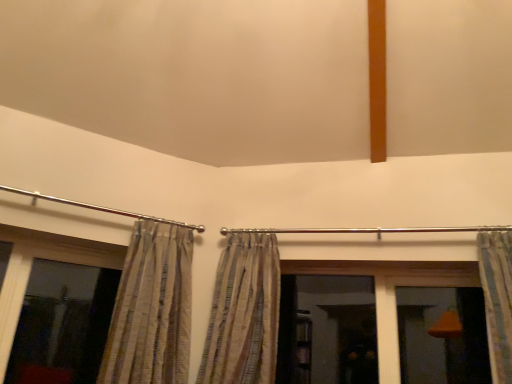
Question: Would you say transparent glass window at left is a long distance from striped fabric curtain at left, which is the first curtain in left-to-right order?

Choices:
 (A) no
 (B) yes

Answer: (A)

Question: Could striped fabric curtain at left, which is the first curtain in left-to-right order, be considered to be inside transparent glass window at left?

Choices:
 (A) no
 (B) yes

Answer: (A)

Question: From a real-world perspective, is transparent glass window at left on striped fabric curtain at left, which is the third curtain from right to left?

Choices:
 (A) no
 (B) yes

Answer: (A)

Question: Is transparent glass window at left to the left of striped fabric curtain at left, which is the third curtain from right to left, from the viewer's perspective?

Choices:
 (A) yes
 (B) no

Answer: (A)

Question: Is transparent glass window at left oriented towards striped fabric curtain at left, which is the third curtain from right to left?

Choices:
 (A) no
 (B) yes

Answer: (B)

Question: Can you confirm if transparent glass window at left is bigger than striped fabric curtain at left, which is the third curtain from right to left?

Choices:
 (A) no
 (B) yes

Answer: (A)

Question: Does striped fabric curtain at right, the third curtain when ordered from left to right, have a greater height compared to striped fabric curtain at center, which is the second curtain from right to left?

Choices:
 (A) yes
 (B) no

Answer: (B)

Question: Considering the relative positions of striped fabric curtain at right, which ranks as the 1th curtain in right-to-left order, and striped fabric curtain at center, marked as the second curtain in a left-to-right arrangement, in the image provided, is striped fabric curtain at right, which ranks as the 1th curtain in right-to-left order, to the left of striped fabric curtain at center, marked as the second curtain in a left-to-right arrangement, from the viewer's perspective?

Choices:
 (A) no
 (B) yes

Answer: (A)

Question: From a real-world perspective, is striped fabric curtain at right, which ranks as the 1th curtain in right-to-left order, positioned under striped fabric curtain at center, marked as the second curtain in a left-to-right arrangement, based on gravity?

Choices:
 (A) yes
 (B) no

Answer: (B)

Question: Is striped fabric curtain at right, the third curtain when ordered from left to right, not near striped fabric curtain at center, which is the second curtain from right to left?

Choices:
 (A) yes
 (B) no

Answer: (A)

Question: Would you say striped fabric curtain at center, marked as the second curtain in a left-to-right arrangement, is part of striped fabric curtain at right, which ranks as the 1th curtain in right-to-left order,'s contents?

Choices:
 (A) no
 (B) yes

Answer: (A)

Question: Is striped fabric curtain at right, which ranks as the 1th curtain in right-to-left order, turned away from striped fabric curtain at center, which is the second curtain from right to left?

Choices:
 (A) yes
 (B) no

Answer: (B)

Question: Is striped fabric curtain at left, which is the third curtain from right to left, positioned far away from striped fabric curtain at right, the third curtain when ordered from left to right?

Choices:
 (A) no
 (B) yes

Answer: (B)